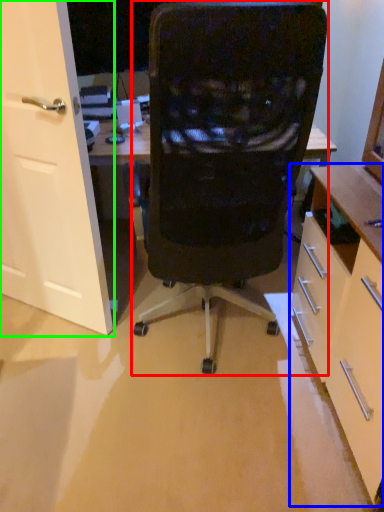
Question: Considering the real-world distances, which object is farthest from chair (highlighted by a red box)? cabinetry (highlighted by a blue box) or door (highlighted by a green box)?

Choices:
 (A) cabinetry
 (B) door

Answer: (B)